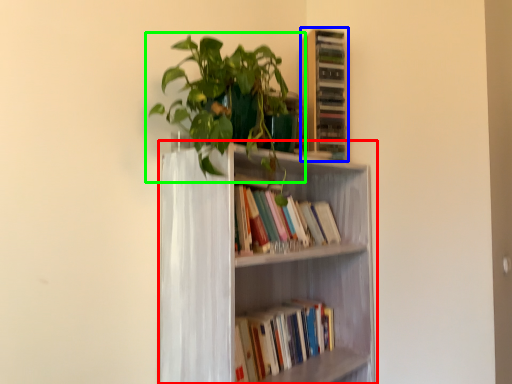
Question: Considering the real-world distances, which object is closest to bookcase (highlighted by a red box)? shelf (highlighted by a blue box) or houseplant (highlighted by a green box).

Choices:
 (A) shelf
 (B) houseplant

Answer: (B)